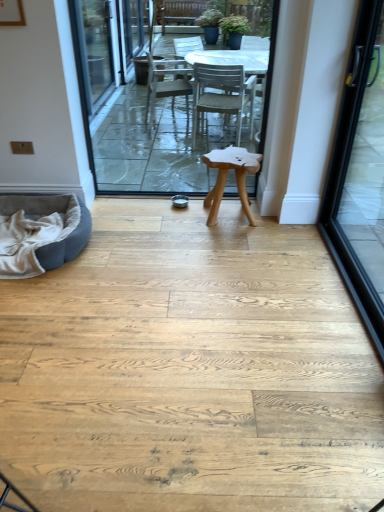
Question: Is white plastic table at center taller or shorter than black glass door at right?

Choices:
 (A) tall
 (B) short

Answer: (A)

Question: Looking at their shapes, would you say white plastic table at center is wider or thinner than black glass door at right?

Choices:
 (A) thin
 (B) wide

Answer: (A)

Question: Which is farther from the gray suede bean bag at lower left?

Choices:
 (A) black glass door at right
 (B) natural wood stool at center
 (C) white plastic table at center

Answer: (A)

Question: Which object is the closest to the white plastic table at center?

Choices:
 (A) natural wood stool at center
 (B) gray suede bean bag at lower left
 (C) black glass door at right

Answer: (A)